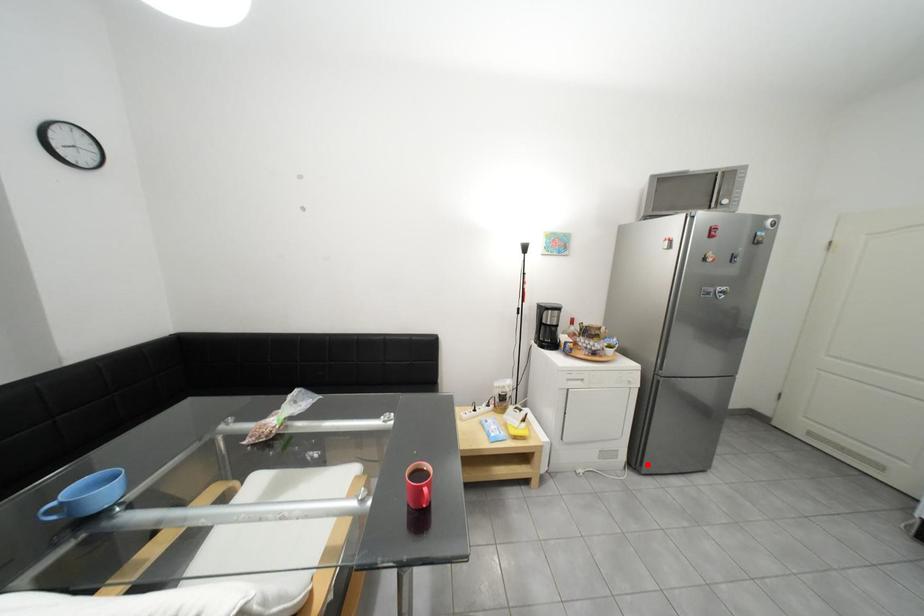
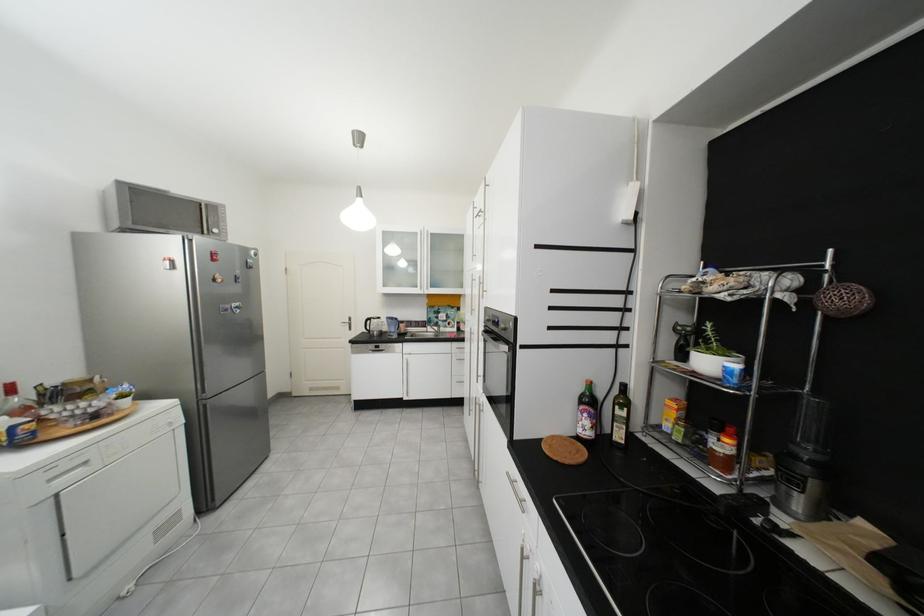
Find the pixel in the second image that matches the highlighted location in the first image.

(217, 505)